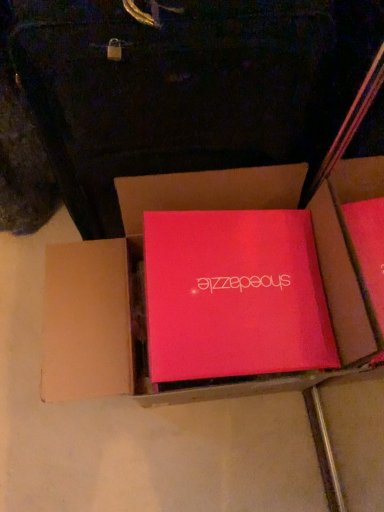
Question: Can you confirm if matte pink box at center, the 1th box in the right-to-left sequence, is smaller than matte red box at center, which is the 2th box from right to left?

Choices:
 (A) yes
 (B) no

Answer: (A)

Question: Is matte red box at center, the 1th box viewed from the left, at the back of matte pink box at center, the 1th box in the right-to-left sequence?

Choices:
 (A) no
 (B) yes

Answer: (B)

Question: From the image's perspective, does matte pink box at center, the 1th box in the right-to-left sequence, appear higher than matte red box at center, which is the 2th box from right to left?

Choices:
 (A) yes
 (B) no

Answer: (A)

Question: Can you confirm if matte pink box at center, arranged as the 2th box when viewed from the left, is shorter than matte red box at center, the 1th box viewed from the left?

Choices:
 (A) no
 (B) yes

Answer: (B)

Question: Could you tell me if matte pink box at center, arranged as the 2th box when viewed from the left, is facing matte red box at center, the 1th box viewed from the left?

Choices:
 (A) no
 (B) yes

Answer: (B)

Question: From a real-world perspective, is matte pink box at center, arranged as the 2th box when viewed from the left, over matte red box at center, which is the 2th box from right to left?

Choices:
 (A) no
 (B) yes

Answer: (B)

Question: Is matte red box at center, which is the 2th box from right to left, closer to camera compared to matte pink box at center, the 1th box in the right-to-left sequence?

Choices:
 (A) no
 (B) yes

Answer: (B)

Question: Does matte red box at center, which is the 2th box from right to left, have a larger size compared to matte pink box at center, arranged as the 2th box when viewed from the left?

Choices:
 (A) yes
 (B) no

Answer: (A)

Question: Is matte red box at center, the 1th box viewed from the left, taller than matte pink box at center, the 1th box in the right-to-left sequence?

Choices:
 (A) yes
 (B) no

Answer: (A)

Question: Can you confirm if matte red box at center, which is the 2th box from right to left, is smaller than matte pink box at center, the 1th box in the right-to-left sequence?

Choices:
 (A) no
 (B) yes

Answer: (A)

Question: Is matte pink box at center, arranged as the 2th box when viewed from the left, inside matte red box at center, which is the 2th box from right to left?

Choices:
 (A) yes
 (B) no

Answer: (A)

Question: Can you confirm if matte red box at center, which is the 2th box from right to left, is positioned to the left of matte pink box at center, arranged as the 2th box when viewed from the left?

Choices:
 (A) no
 (B) yes

Answer: (B)

Question: Looking at their shapes, would you say matte pink box at center, arranged as the 2th box when viewed from the left, is wider or thinner than matte red box at center, which is the 2th box from right to left?

Choices:
 (A) wide
 (B) thin

Answer: (B)